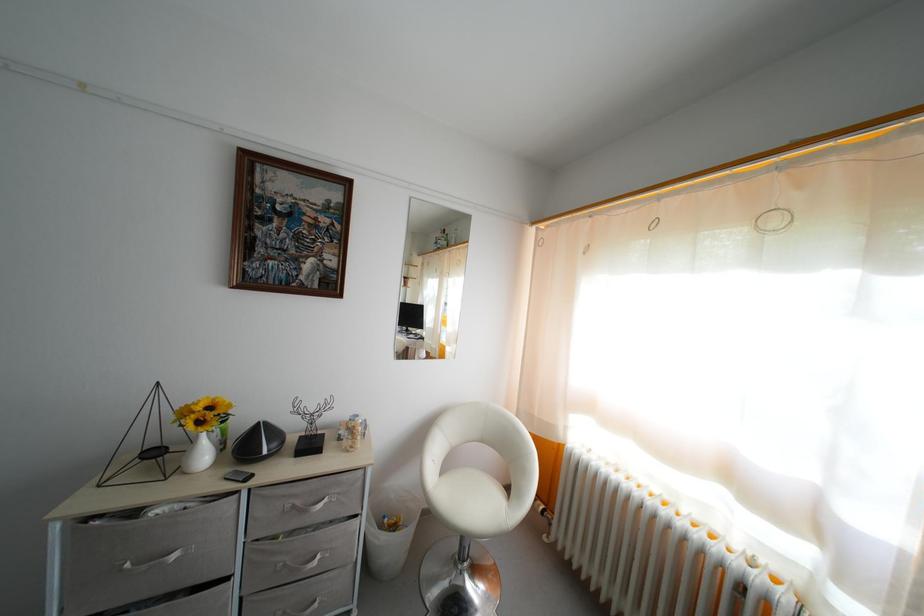
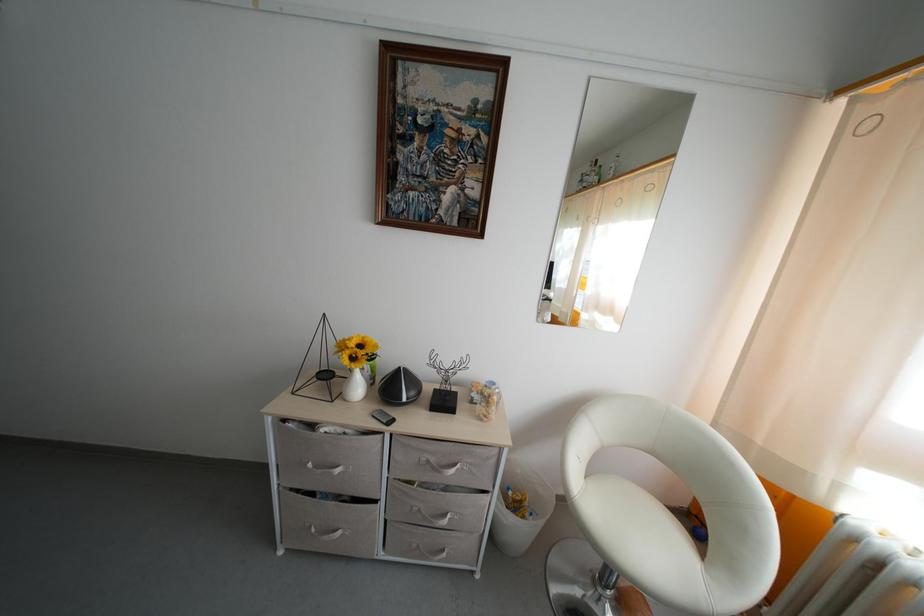
What movement of the cameraman would produce the second image?

The movement direction of the cameraman is left, forward.